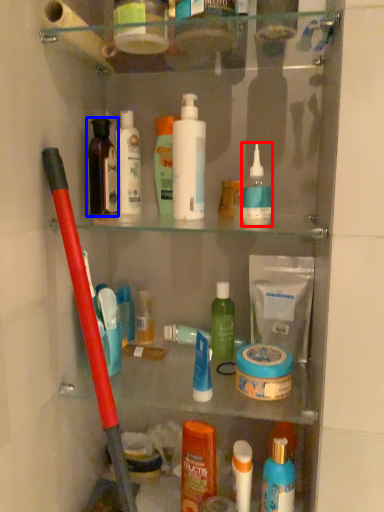
Question: Which of the following is the farthest to the observer, cleaning product (highlighted by a red box) or toiletry (highlighted by a blue box)?

Choices:
 (A) cleaning product
 (B) toiletry

Answer: (B)